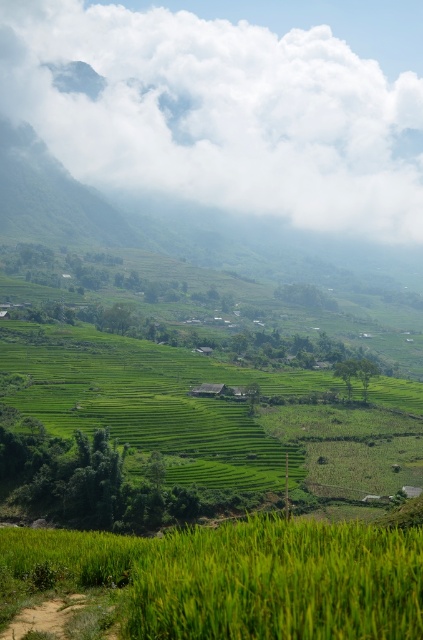
Question: Among these points, which one is nearest to the camera?

Choices:
 (A) (318, 392)
 (B) (202, 147)

Answer: (A)

Question: Which point is closer to the camera?

Choices:
 (A) white fluffy cloud at upper center
 (B) green grassy rice field at lower center
 (C) green grassy field at center

Answer: (B)

Question: Which point is closer to the camera taking this photo?

Choices:
 (A) coord(318,410)
 (B) coord(16,563)

Answer: (B)

Question: Can you confirm if white fluffy cloud at upper center is positioned to the left of green grassy field at center?

Choices:
 (A) no
 (B) yes

Answer: (A)

Question: Can you confirm if white fluffy cloud at upper center is bigger than green grassy field at center?

Choices:
 (A) no
 (B) yes

Answer: (B)

Question: Is white fluffy cloud at upper center thinner than green grassy field at center?

Choices:
 (A) yes
 (B) no

Answer: (B)